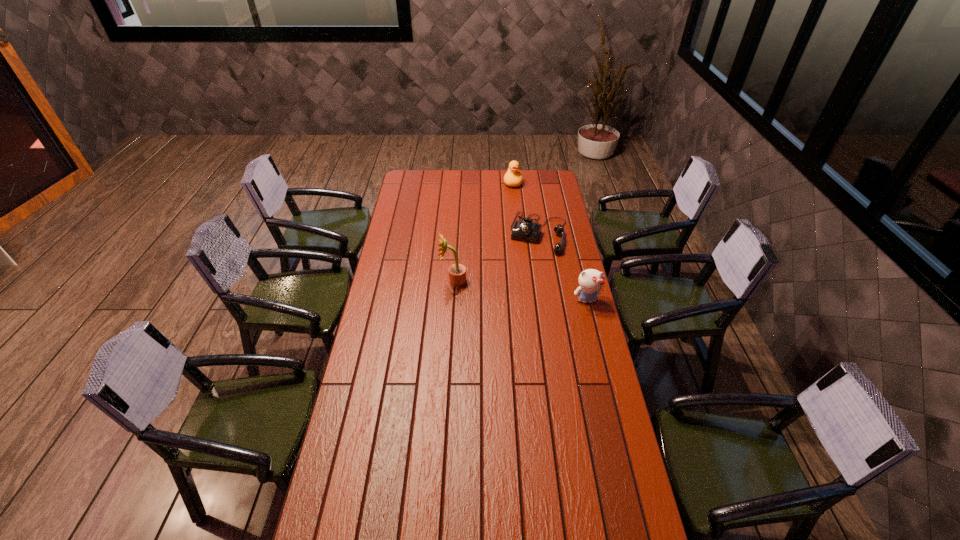
Identify the location of free space located on the face of the leftmost object. (395, 281).

You are a GUI agent. You are given a task and a screenshot of the screen. Output one action in this format:
    pyautogui.click(x=<x>, y=<y>)
    Task: Click on the vacant point located 0.280m on the front-facing side of the kitten
    
    Given the screenshot: What is the action you would take?
    pyautogui.click(x=602, y=362)

The width and height of the screenshot is (960, 540). I want to click on free space located on the dial of the telephone, so click(523, 301).

Where is `vacant region located 0.330m on the dial of the telephone`? vacant region located 0.330m on the dial of the telephone is located at coordinates (522, 303).

The width and height of the screenshot is (960, 540). I want to click on vacant region located 0.250m on the dial of the telephone, so click(x=526, y=291).

Locate an element on the screen. free space located 0.190m on the face of the farthest object is located at coordinates (514, 208).

Where is `free region located 0.340m on the face of the farthest object`? The width and height of the screenshot is (960, 540). free region located 0.340m on the face of the farthest object is located at coordinates (515, 224).

This screenshot has height=540, width=960. In order to click on vacant space situated on the face of the farthest object in this screenshot , I will do `click(514, 200)`.

Where is `object that is at the far edge`? object that is at the far edge is located at coordinates (513, 178).

At what (x,y) coordinates should I click in order to perform the action: click on kitten present at the right edge. Please return your answer as a coordinate pair (x, y). This screenshot has width=960, height=540. Looking at the image, I should click on (591, 281).